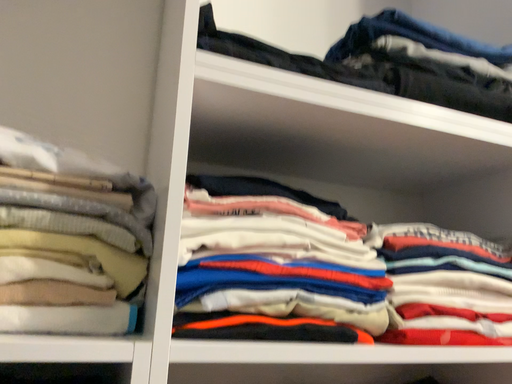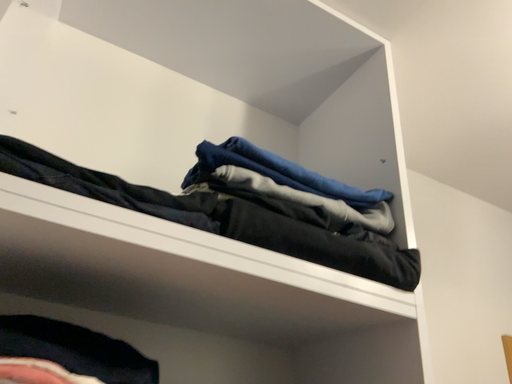
Question: Which way did the camera rotate in the video?

Choices:
 (A) rotated left
 (B) rotated right

Answer: (B)